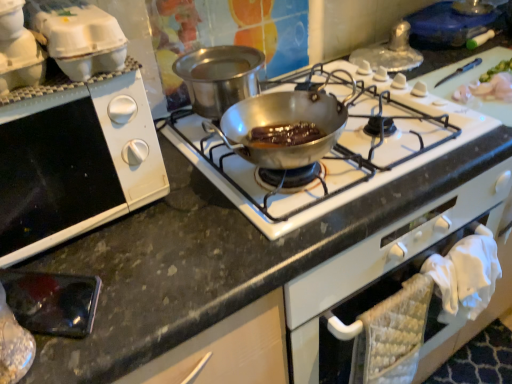
Question: Does white cardboard egg carton at upper left lie behind white matte oven at left?

Choices:
 (A) no
 (B) yes

Answer: (B)

Question: Is white matte oven at left completely or partially inside white cardboard egg carton at upper left?

Choices:
 (A) yes
 (B) no

Answer: (B)

Question: From the image's perspective, is white cardboard egg carton at upper left beneath white matte oven at left?

Choices:
 (A) no
 (B) yes

Answer: (A)

Question: Considering the relative sizes of white cardboard egg carton at upper left and white matte oven at left in the image provided, is white cardboard egg carton at upper left thinner than white matte oven at left?

Choices:
 (A) yes
 (B) no

Answer: (A)

Question: From a real-world perspective, is white cardboard egg carton at upper left beneath white matte oven at left?

Choices:
 (A) yes
 (B) no

Answer: (B)

Question: Is white cardboard egg carton at upper left positioned beyond the bounds of white matte oven at left?

Choices:
 (A) yes
 (B) no

Answer: (A)

Question: From a real-world perspective, is white cardboard egg carton at upper left positioned under shiny silver pan at center based on gravity?

Choices:
 (A) yes
 (B) no

Answer: (B)

Question: Is white cardboard egg carton at upper left taller than shiny silver pan at center?

Choices:
 (A) yes
 (B) no

Answer: (A)

Question: Can shiny silver pan at center be found inside white cardboard egg carton at upper left?

Choices:
 (A) no
 (B) yes

Answer: (A)

Question: Is white cardboard egg carton at upper left smaller than shiny silver pan at center?

Choices:
 (A) yes
 (B) no

Answer: (A)

Question: Is the depth of white cardboard egg carton at upper left greater than that of shiny silver pan at center?

Choices:
 (A) yes
 (B) no

Answer: (B)

Question: Does white cardboard egg carton at upper left come in front of shiny silver pan at center?

Choices:
 (A) no
 (B) yes

Answer: (B)

Question: Is stainless steel pan at center at the left side of white cardboard egg carton at upper left?

Choices:
 (A) no
 (B) yes

Answer: (A)